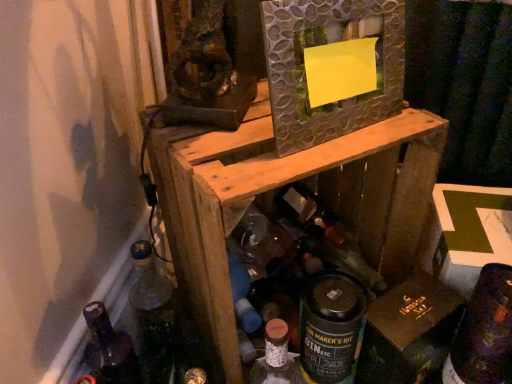
Question: Is translucent glass bottle at center, the second bottle from the left, closer to the viewer compared to textured silver mirror at center?

Choices:
 (A) yes
 (B) no

Answer: (B)

Question: Is translucent glass bottle at center, the second bottle from the left, facing towards textured silver mirror at center?

Choices:
 (A) yes
 (B) no

Answer: (B)

Question: Considering the relative sizes of translucent glass bottle at center, the second bottle from the left, and textured silver mirror at center in the image provided, is translucent glass bottle at center, the second bottle from the left, smaller than textured silver mirror at center?

Choices:
 (A) no
 (B) yes

Answer: (A)

Question: From the image's perspective, is translucent glass bottle at center, the second bottle from the left, under textured silver mirror at center?

Choices:
 (A) no
 (B) yes

Answer: (B)

Question: Can you confirm if translucent glass bottle at center, which is the second bottle from right to left, is taller than textured silver mirror at center?

Choices:
 (A) yes
 (B) no

Answer: (A)

Question: Does translucent glass bottle at center, the second bottle from the left, have a larger size compared to textured silver mirror at center?

Choices:
 (A) yes
 (B) no

Answer: (A)

Question: Is wooden crate at center positioned in front of translucent glass wine bottle at center, placed as the 1th wine bottle when sorted from back to front?

Choices:
 (A) yes
 (B) no

Answer: (A)

Question: Does wooden crate at center turn towards translucent glass wine bottle at center, which is the second wine bottle from right to left?

Choices:
 (A) no
 (B) yes

Answer: (B)

Question: Considering the relative sizes of wooden crate at center and translucent glass wine bottle at center, which is the first wine bottle in left-to-right order, in the image provided, is wooden crate at center taller than translucent glass wine bottle at center, which is the first wine bottle in left-to-right order,?

Choices:
 (A) no
 (B) yes

Answer: (B)

Question: From a real-world perspective, is wooden crate at center located higher than translucent glass wine bottle at center, which is counted as the 1th wine bottle, starting from the top?

Choices:
 (A) yes
 (B) no

Answer: (A)

Question: Is wooden crate at center positioned with its back to translucent glass wine bottle at center, positioned as the 2th wine bottle in bottom-to-top order?

Choices:
 (A) yes
 (B) no

Answer: (A)

Question: Is the depth of wooden crate at center greater than that of translucent glass wine bottle at center, which is the first wine bottle in left-to-right order?

Choices:
 (A) yes
 (B) no

Answer: (B)

Question: From the image's perspective, does dark purple glass wine bottle at lower right, which is the first wine bottle in right-to-left order, appear lower than translucent glass bottle at lower left, positioned as the 1th bottle in left-to-right order?

Choices:
 (A) no
 (B) yes

Answer: (A)